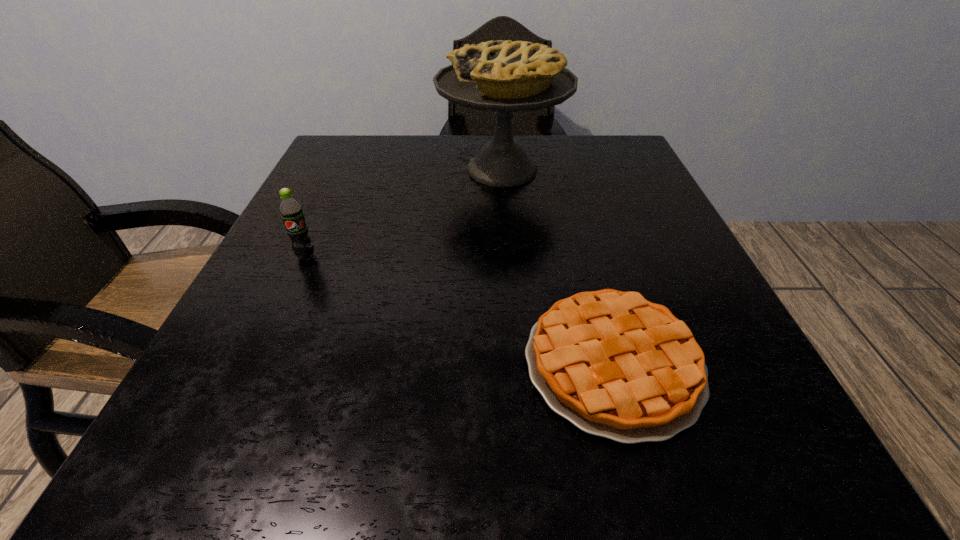
Where is `free spot that satisfies the following two spatial constraints: 1. on the cut side of the tallest object; 2. on the right side of the shortest object`? This screenshot has height=540, width=960. free spot that satisfies the following two spatial constraints: 1. on the cut side of the tallest object; 2. on the right side of the shortest object is located at coordinates [517, 364].

You are a GUI agent. You are given a task and a screenshot of the screen. Output one action in this format:
    pyautogui.click(x=<x>, y=<y>)
    Task: Click on the vacant area in the image that satisfies the following two spatial constraints: 1. on the cut side of the farther pie; 2. on the left side of the nearest object
    This screenshot has height=540, width=960.
    Given the screenshot: What is the action you would take?
    pyautogui.click(x=517, y=364)

Locate an element on the screen. vacant space that satisfies the following two spatial constraints: 1. on the front label of the nearer pie; 2. on the left side of the leftmost object is located at coordinates (256, 364).